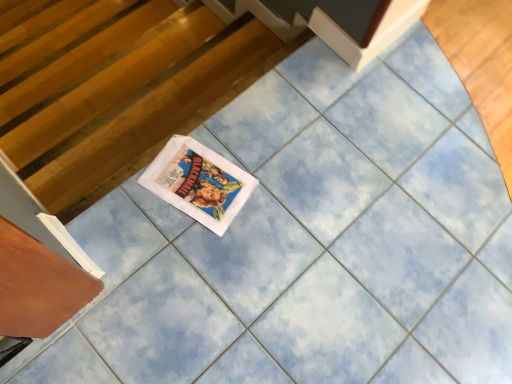
I want to click on free space to the back side of white paper comic book at center, so click(238, 132).